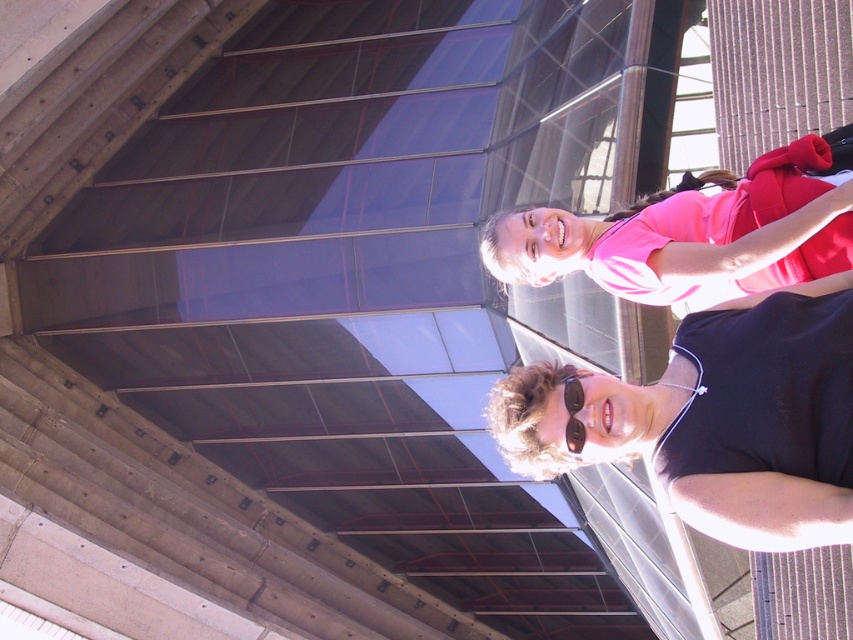
Looking at this image, does pink fabric shirt at upper right have a smaller size compared to black plastic goggles at lower center?

No.

Does pink fabric shirt at upper right have a lesser height compared to black plastic goggles at lower center?

In fact, pink fabric shirt at upper right may be taller than black plastic goggles at lower center.

Locate an element on the screen. pink fabric shirt at upper right is located at coordinates (692, 236).

The image size is (853, 640). Identify the location of pink fabric shirt at upper right. (692, 236).

In the scene shown: Between black matte sunglasses at lower right and pink fabric shirt at upper right, which one appears on the left side from the viewer's perspective?

black matte sunglasses at lower right

Can you confirm if black matte sunglasses at lower right is positioned to the left of pink fabric shirt at upper right?

Indeed, black matte sunglasses at lower right is positioned on the left side of pink fabric shirt at upper right.

Is point (712, 333) closer to viewer compared to point (758, 243)?

Yes.

Find the location of `black matte sunglasses at lower right`. black matte sunglasses at lower right is located at coordinates (721, 420).

Which is more to the left, black matte sunglasses at lower right or black plastic goggles at lower center?

black plastic goggles at lower center

Can you confirm if black matte sunglasses at lower right is positioned below black plastic goggles at lower center?

Actually, black matte sunglasses at lower right is above black plastic goggles at lower center.

Is point (535, 432) in front of point (572, 420)?

No.

Identify the location of black matte sunglasses at lower right. The image size is (853, 640). (721, 420).